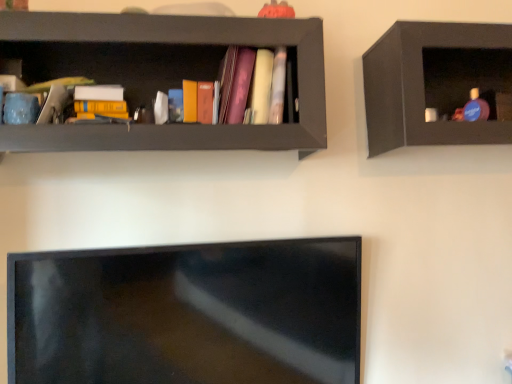
Question: Is point (462, 56) positioned closer to the camera than point (306, 43)?

Choices:
 (A) closer
 (B) farther

Answer: (B)

Question: Considering the relative positions of matte black shelf at upper right, which is the 2th shelf from left to right, and matte black shelf at upper left, the 1th shelf viewed from the left, in the image provided, is matte black shelf at upper right, which is the 2th shelf from left to right, to the left or to the right of matte black shelf at upper left, the 1th shelf viewed from the left,?

Choices:
 (A) left
 (B) right

Answer: (B)

Question: Which object is the farthest from the matte black shelf at upper left, the 1th shelf viewed from the left?

Choices:
 (A) matte black shelf at upper right, which is the 2th shelf from left to right
 (B) matte pink book at center

Answer: (A)

Question: Based on their relative distances, which object is farther from the matte pink book at center?

Choices:
 (A) matte black shelf at upper right, which is the 2th shelf from left to right
 (B) matte black shelf at upper left, positioned as the second shelf in right-to-left order

Answer: (A)